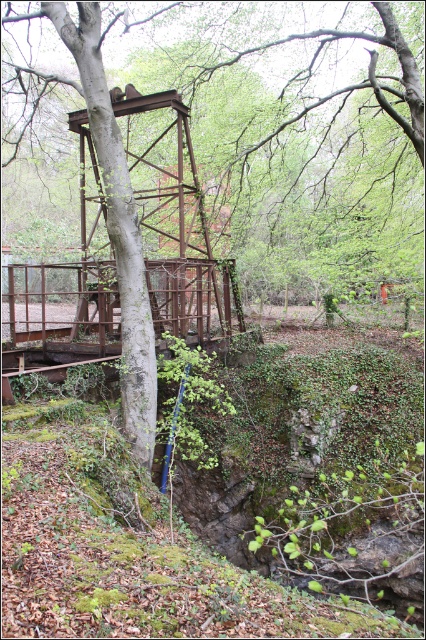
You are a hiker trying to decide whether to cross the rusty metal bridge at center or climb the green mossy hillside at lower left. Which option requires less physical effort?

The green mossy hillside at lower left is not as tall as the rusty metal bridge at center, so climbing it would require less physical effort compared to crossing the bridge which is taller.

You are a hiker trying to cross the rusty metal bridge at center. You notice a green mossy hillside at lower left. Which direction should you go to avoid the hillside while crossing the bridge?

To avoid the green mossy hillside at lower left while crossing the rusty metal bridge at center, you should move towards the right side of the bridge since the hillside is positioned under the left side of the bridge.